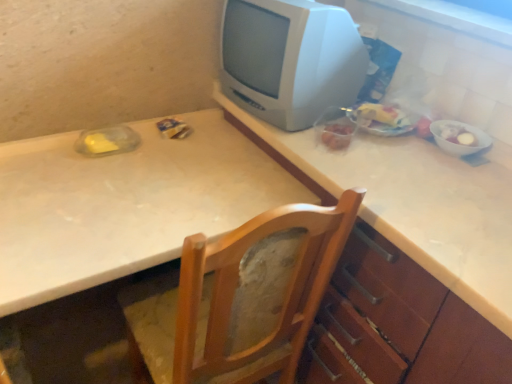
Question: Is white glossy counter top at upper center inside the boundaries of translucent plastic bag of food at right, positioned as the 2th food in right-to-left order, or outside?

Choices:
 (A) inside
 (B) outside

Answer: (B)

Question: Is point (462, 291) positioned closer to the camera than point (367, 112)?

Choices:
 (A) closer
 (B) farther

Answer: (A)

Question: Which object is positioned closest to the white glossy counter top at upper center?

Choices:
 (A) white glossy window sill at upper right
 (B) white plastic television at upper right
 (C) white glossy bowl at right, which is the 2th food in left-to-right order
 (D) white laminate table at center
 (E) wooden chair at center

Answer: (B)

Question: Considering the real-world distances, which object is closest to the translucent plastic bag of food at right, positioned as the 2th food in right-to-left order?

Choices:
 (A) white glossy window sill at upper right
 (B) wooden chair at center
 (C) white plastic television at upper right
 (D) white glossy counter top at upper center
 (E) white glossy bowl at right, arranged as the first food when viewed from the right

Answer: (E)